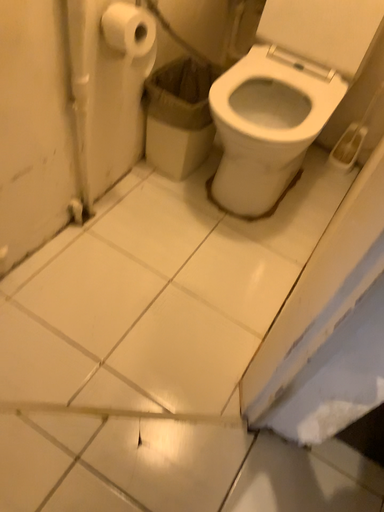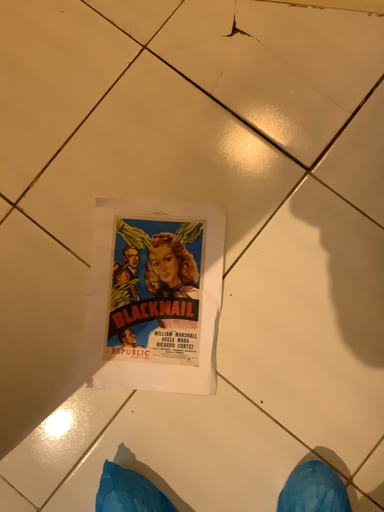
Question: How did the camera likely rotate when shooting the video?

Choices:
 (A) rotated left
 (B) rotated right

Answer: (A)